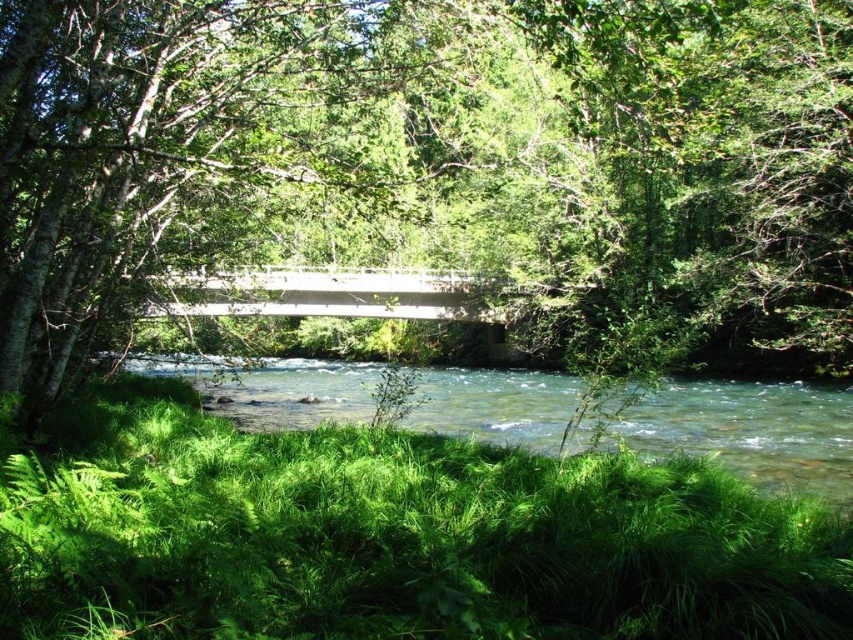
Based on the photo, which is below, green leafy grass at lower center or clear water at center?

clear water at center

Does point (827, 592) come farther from viewer compared to point (675, 440)?

That is False.

Image resolution: width=853 pixels, height=640 pixels. I want to click on green leafy grass at lower center, so click(x=390, y=538).

Consider the image. Is green leafy tree at center to the right of green leafy grass at lower center from the viewer's perspective?

Yes, green leafy tree at center is to the right of green leafy grass at lower center.

Is point (187, 280) closer to camera compared to point (141, 416)?

No, it is behind (141, 416).

The height and width of the screenshot is (640, 853). Find the location of `green leafy tree at center`. green leafy tree at center is located at coordinates (432, 177).

Between green leafy tree at center and clear water at center, which one is positioned higher?

green leafy tree at center is above.

Which is below, green leafy tree at center or clear water at center?

clear water at center

The width and height of the screenshot is (853, 640). What are the coordinates of `green leafy tree at center` in the screenshot? It's located at (432, 177).